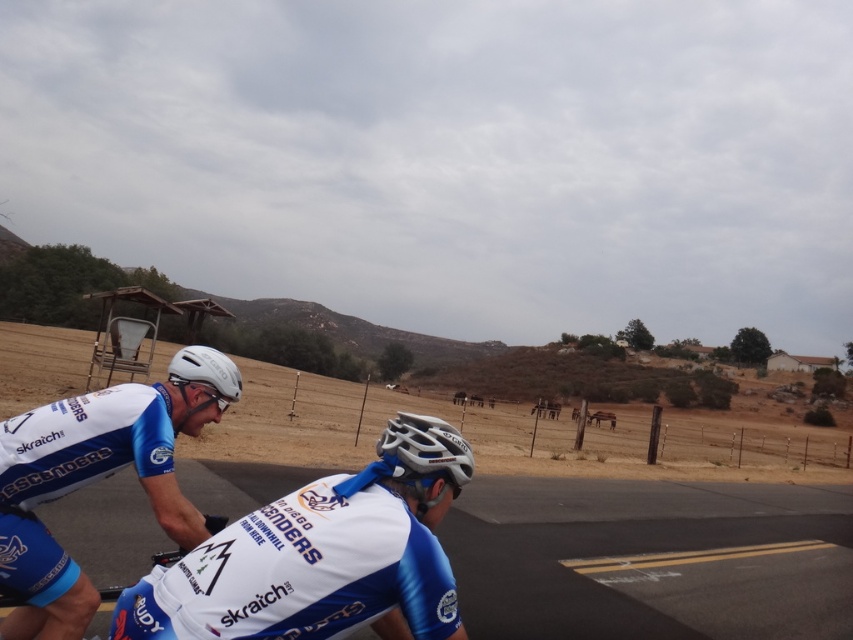
You are a photographer positioned at the lower right corner of the image. You want to capture a photo that includes both the white matte helmet at upper left and the blue matte bicycle at lower left. Which object should you adjust your camera angle upwards to include?

You should adjust your camera angle upwards to include the white matte helmet at upper left because it is positioned above the blue matte bicycle at lower left.

You are a photographer positioned at the lower right of the image. You want to capture a photo that includes both the white glossy helmet at upper left and the blue matte bicycle at lower left. Which object should you adjust your camera angle to focus on first to ensure both are in frame?

The white glossy helmet at upper left is above the blue matte bicycle at lower left, so you should adjust your camera angle to focus on the white glossy helmet at upper left first to ensure both are in frame.